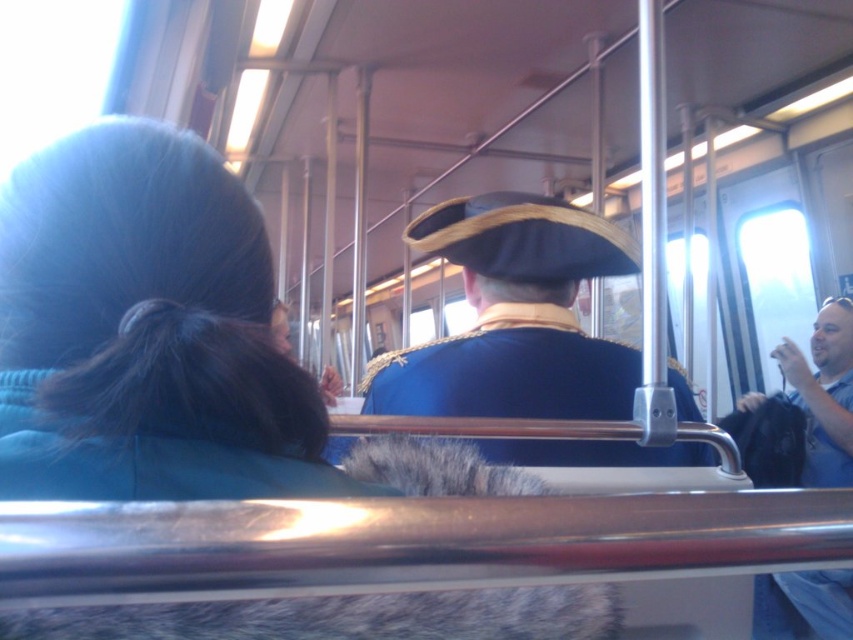
In the scene shown: Does blue velvet coat at center lie behind blue cotton shirt at right?

No, it is not.

This screenshot has width=853, height=640. Describe the element at coordinates (514, 316) in the screenshot. I see `blue velvet coat at center` at that location.

Which is in front, point (637, 381) or point (793, 612)?

Point (637, 381) is more forward.

This screenshot has height=640, width=853. I want to click on blue velvet coat at center, so click(514, 316).